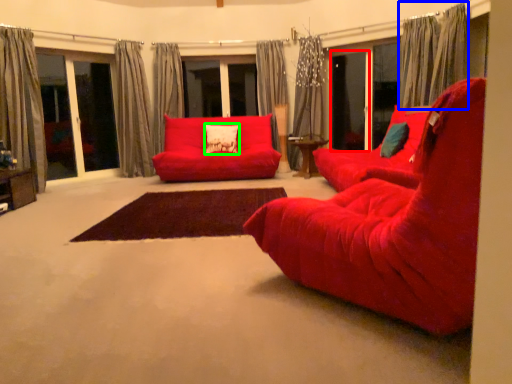
Question: Based on their relative distances, which object is nearer to screen door (highlighted by a red box)? Choose from curtain (highlighted by a blue box) and pillow (highlighted by a green box).

Choices:
 (A) curtain
 (B) pillow

Answer: (A)